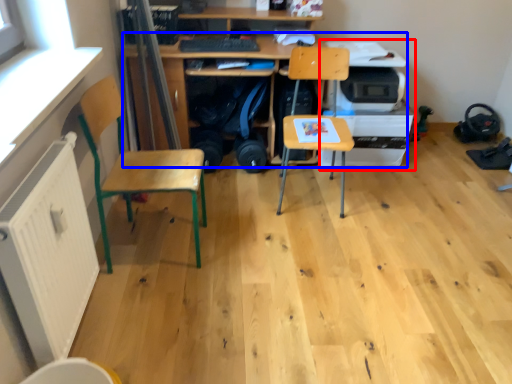
Question: Which object is closer to the camera taking this photo, printer (highlighted by a red box) or desk (highlighted by a blue box)?

Choices:
 (A) printer
 (B) desk

Answer: (B)